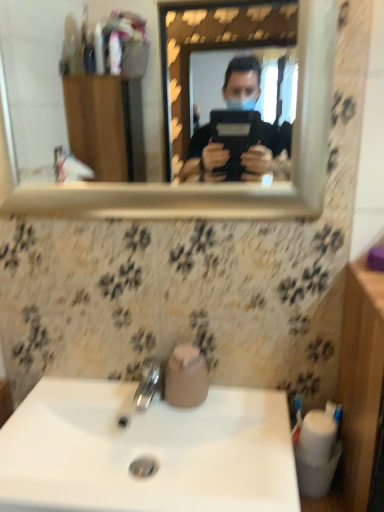
I want to click on free region on the left part of polished chrome tap at center, so click(x=75, y=405).